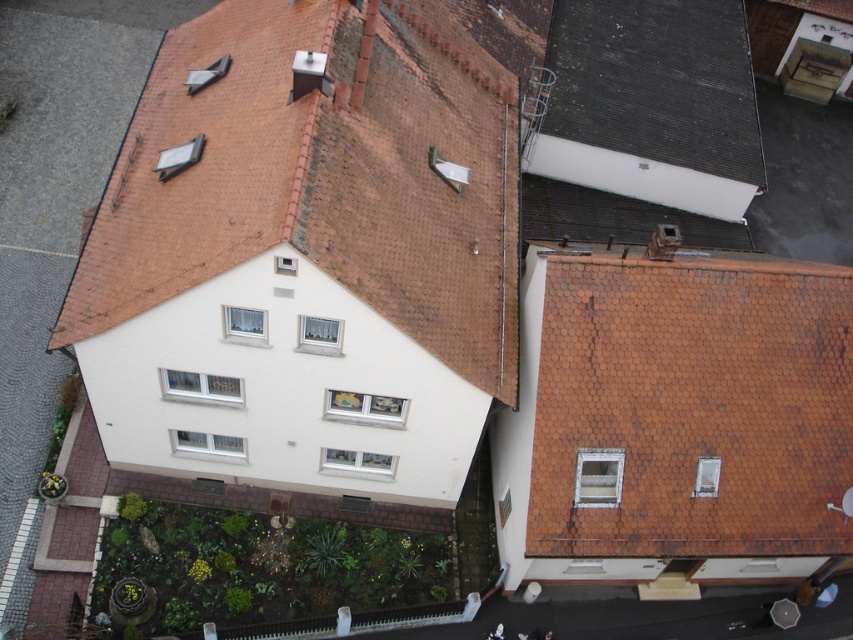
Question: Among these objects, which one is nearest to the camera?

Choices:
 (A) brown tile roof at upper center
 (B) black shingles at upper center

Answer: (A)

Question: Is brown tile roof at upper center further to camera compared to black shingles at upper center?

Choices:
 (A) no
 (B) yes

Answer: (A)

Question: Can you confirm if brown tile roof at upper center is thinner than black shingles at upper center?

Choices:
 (A) yes
 (B) no

Answer: (B)

Question: Which of the following is the farthest from the observer?

Choices:
 (A) brown tile roof at upper center
 (B) black shingles at upper center

Answer: (B)

Question: Which object appears closest to the camera in this image?

Choices:
 (A) black shingles at upper center
 (B) brown tile roof at upper center

Answer: (B)

Question: Can you confirm if brown tile roof at upper center is smaller than black shingles at upper center?

Choices:
 (A) yes
 (B) no

Answer: (B)